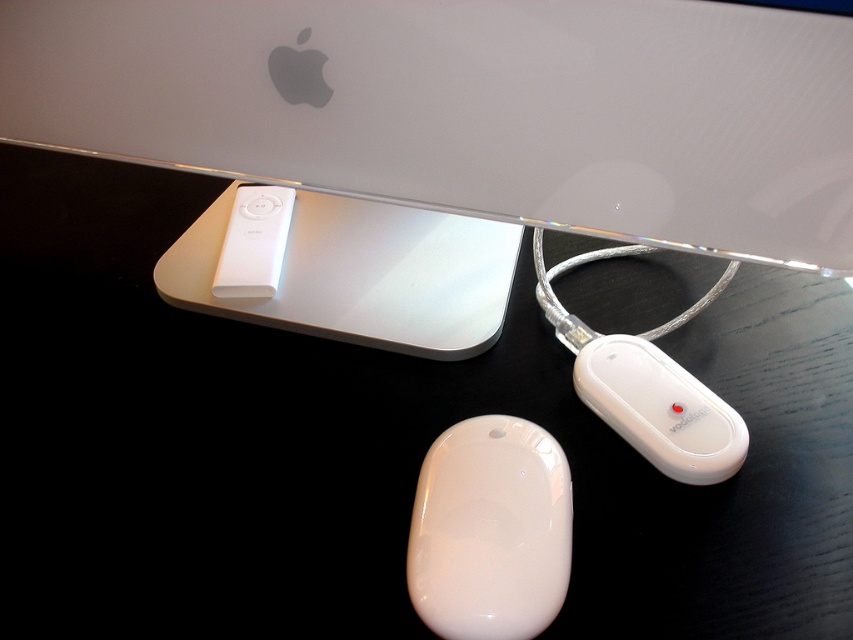
Who is more distant from viewer, [544,109] or [543,557]?

The point [544,109] is more distant.

Between sleek silver laptop at upper center and glossy white mouse at lower center, which one appears on the left side from the viewer's perspective?

Positioned to the left is sleek silver laptop at upper center.

Which is behind, point (721, 232) or point (567, 522)?

The point (721, 232) is behind.

Locate an element on the screen. This screenshot has width=853, height=640. sleek silver laptop at upper center is located at coordinates coord(469,108).

Who is higher up, sleek silver laptop at upper center or white glossy charger at lower center?

Positioned higher is sleek silver laptop at upper center.

Can you confirm if sleek silver laptop at upper center is wider than white glossy charger at lower center?

Yes.

You are a GUI agent. You are given a task and a screenshot of the screen. Output one action in this format:
    pyautogui.click(x=<x>, y=<y>)
    Task: Click on the sleek silver laptop at upper center
    The width and height of the screenshot is (853, 640).
    Given the screenshot: What is the action you would take?
    pyautogui.click(x=469, y=108)

Can you confirm if glossy white mouse at lower center is smaller than white glossy charger at lower center?

Yes.

What do you see at coordinates (490, 531) in the screenshot?
I see `glossy white mouse at lower center` at bounding box center [490, 531].

Does point (418, 481) come in front of point (621, 388)?

Yes, it is in front of point (621, 388).

Image resolution: width=853 pixels, height=640 pixels. In order to click on glossy white mouse at lower center in this screenshot , I will do `click(490, 531)`.